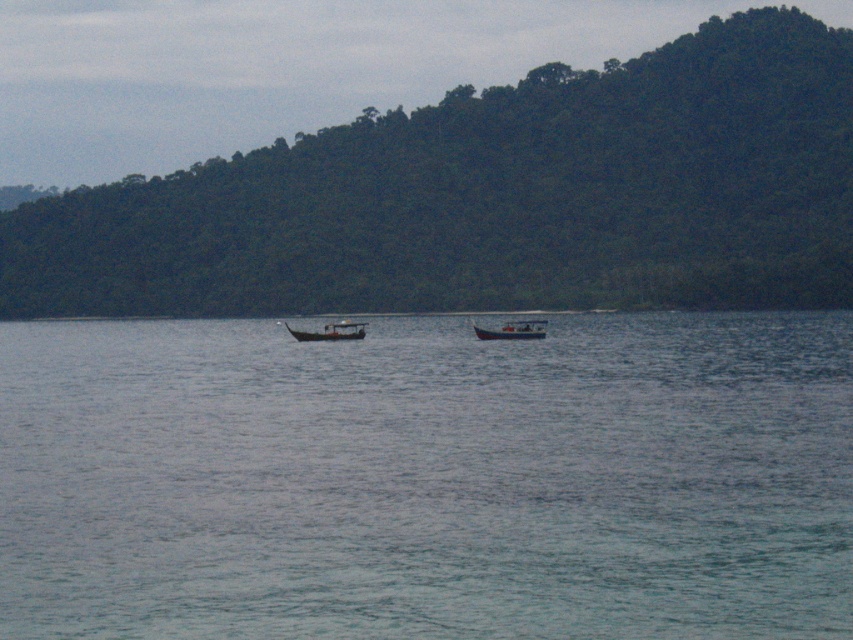
Looking at this image, you are a photographer trying to capture a clear view of the white plastic boat at center without any obstructions. Based on the scene, is the green leafy hillside at upper center blocking your view of the boat?

The white plastic boat at center is behind the green leafy hillside at upper center, so the hillside is blocking the view of the boat.

You are a photographer trying to capture the wooden boat at center while ensuring the green leafy hillside at upper center is visible in the background. Based on their positions, will the hillside be visible behind the boat in your photo?

The green leafy hillside at upper center is located above the wooden boat at center, so yes, the hillside will be visible behind the boat in the photo.